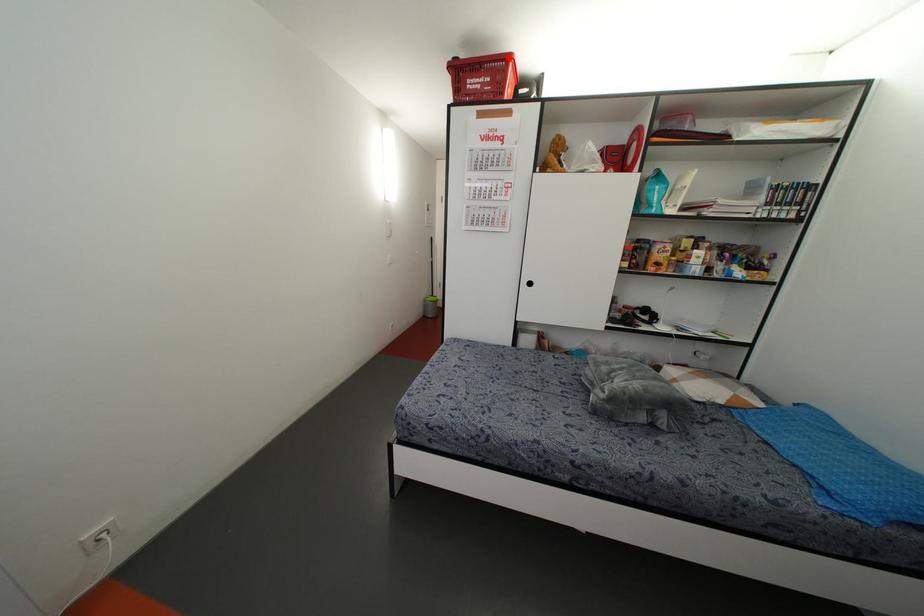
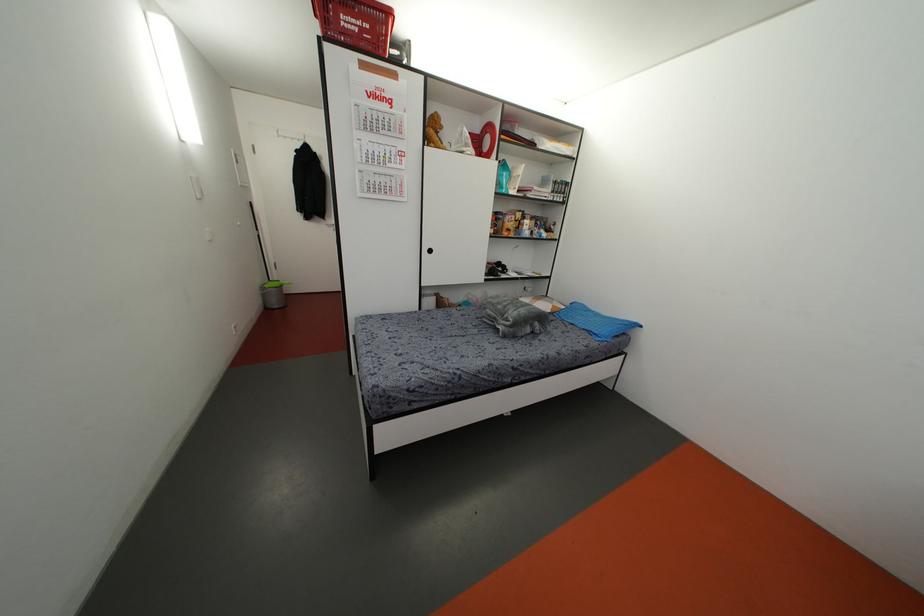
Find the pixel in the second image that matches the highlighted location in the first image.

(388, 13)